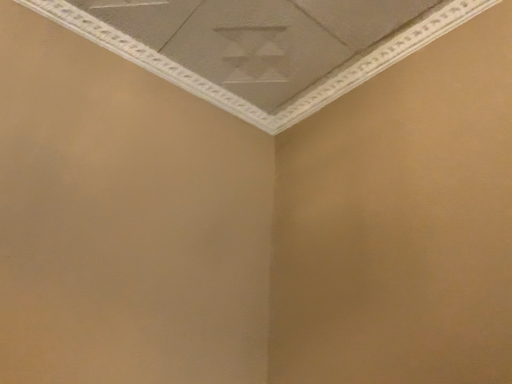
Image resolution: width=512 pixels, height=384 pixels. I want to click on white textured ceiling at upper center, so click(263, 45).

In order to face white textured ceiling at upper center, should I rotate leftwards or rightwards?

A 11.068 degree turn to the left will do.

Describe the element at coordinates (263, 45) in the screenshot. The height and width of the screenshot is (384, 512). I see `white textured ceiling at upper center` at that location.

Where is `white textured ceiling at upper center`? The image size is (512, 384). white textured ceiling at upper center is located at coordinates (263, 45).